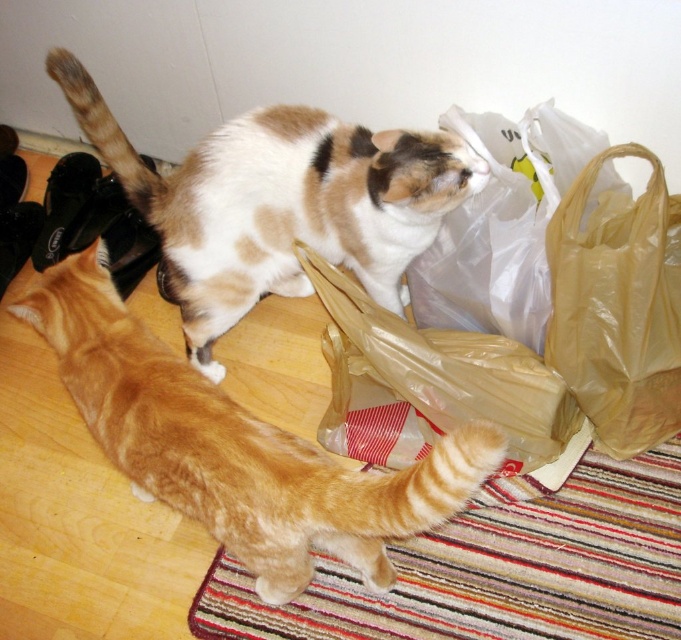
Based on the coordinates provided, where is the orange tabby cat at lower left located in the image?

The orange tabby cat at lower left is located at the 2D coordinates point (236, 445).